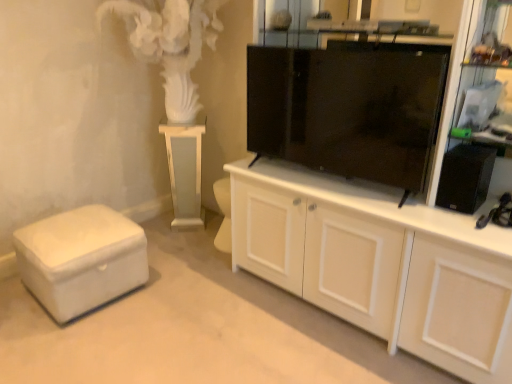
Question: Can you confirm if white wood cabinet at center is thinner than white glossy pedestal at center?

Choices:
 (A) yes
 (B) no

Answer: (B)

Question: Considering the relative sizes of white wood cabinet at center and white glossy pedestal at center in the image provided, is white wood cabinet at center taller than white glossy pedestal at center?

Choices:
 (A) yes
 (B) no

Answer: (A)

Question: Is white wood cabinet at center outside white glossy pedestal at center?

Choices:
 (A) no
 (B) yes

Answer: (B)

Question: Considering the relative sizes of white wood cabinet at center and white glossy pedestal at center in the image provided, is white wood cabinet at center wider than white glossy pedestal at center?

Choices:
 (A) yes
 (B) no

Answer: (A)

Question: Would you consider white wood cabinet at center to be distant from white glossy pedestal at center?

Choices:
 (A) no
 (B) yes

Answer: (B)

Question: Considering the relative positions of white glossy pedestal at center and white leather ottoman at lower left in the image provided, is white glossy pedestal at center to the left or to the right of white leather ottoman at lower left?

Choices:
 (A) right
 (B) left

Answer: (A)

Question: In terms of width, does white glossy pedestal at center look wider or thinner when compared to white leather ottoman at lower left?

Choices:
 (A) wide
 (B) thin

Answer: (B)

Question: Considering their positions, is white glossy pedestal at center located in front of or behind white leather ottoman at lower left?

Choices:
 (A) front
 (B) behind

Answer: (B)

Question: Is point (173, 145) positioned closer to the camera than point (61, 297)?

Choices:
 (A) farther
 (B) closer

Answer: (A)

Question: Is black glossy tv cabinet at center spatially inside white glossy pedestal at center, or outside of it?

Choices:
 (A) inside
 (B) outside

Answer: (B)

Question: Looking at the image, does black glossy tv cabinet at center seem bigger or smaller compared to white glossy pedestal at center?

Choices:
 (A) big
 (B) small

Answer: (B)

Question: Is point (382, 99) closer or farther from the camera than point (178, 205)?

Choices:
 (A) farther
 (B) closer

Answer: (B)

Question: From the image's perspective, is black glossy tv cabinet at center above or below white glossy pedestal at center?

Choices:
 (A) above
 (B) below

Answer: (A)

Question: Based on their positions, is black plastic speaker at right located to the left or right of white leather ottoman at lower left?

Choices:
 (A) right
 (B) left

Answer: (A)

Question: Considering their positions, is black plastic speaker at right located in front of or behind white leather ottoman at lower left?

Choices:
 (A) front
 (B) behind

Answer: (A)